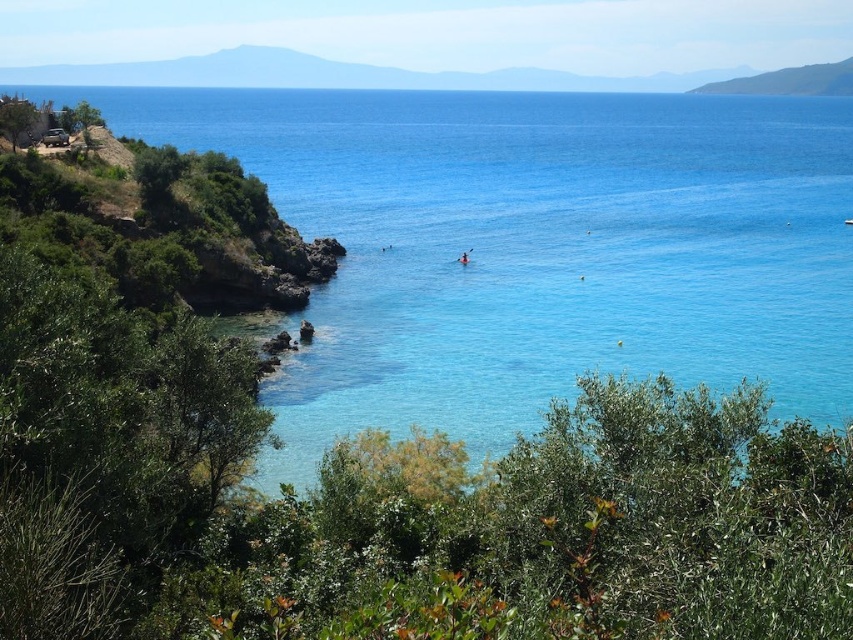
You are planning to take a photo of the orange kayak at center and the clear blue water at center from the shore. Which object should you focus on first if you want to capture both in one shot without moving the camera?

The clear blue water at center has a larger size compared to orange kayak at center, so you should focus on the orange kayak at center first to ensure it is sharp, then adjust exposure for the larger water area.

You are standing at the shoreline looking out at the sea. There are two points marked in the image. The first point is at coordinate point (x=741, y=195) and the second is at coordinate point (x=469, y=259). Which point is closer to your current position?

Point (x=741, y=195) is further to the camera than point (x=469, y=259). Therefore, the point closer to your current position is point (x=469, y=259).